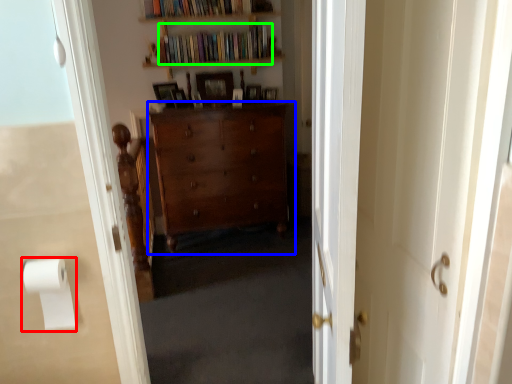
Question: Based on their relative distances, which object is farther from toilet paper (highlighted by a red box)? Choose from cabinetry (highlighted by a blue box) and book (highlighted by a green box).

Choices:
 (A) cabinetry
 (B) book

Answer: (B)